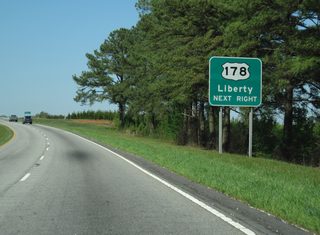
Find the location of `paint`. paint is located at coordinates (24, 177), (39, 159), (47, 149), (47, 145), (47, 138), (43, 133), (36, 130), (207, 209).